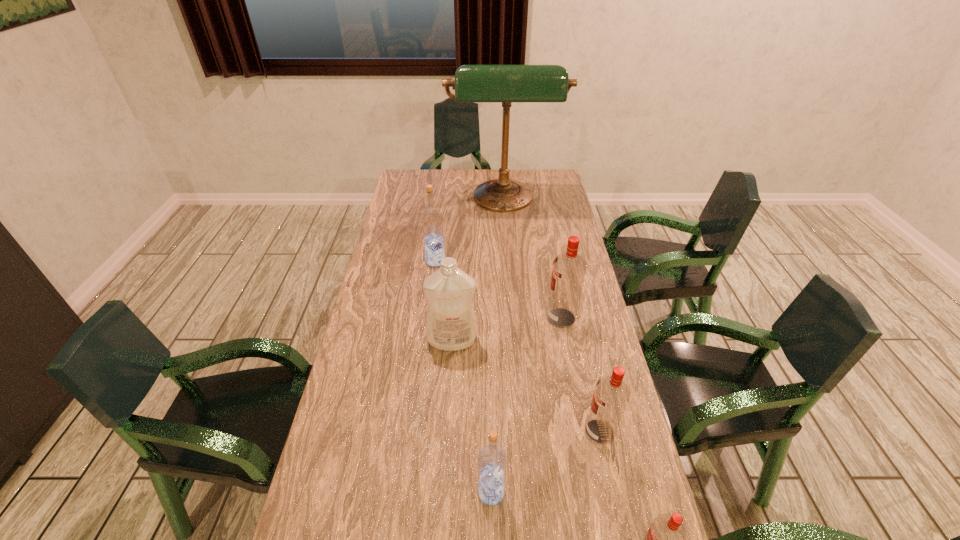
You are a GUI agent. You are given a task and a screenshot of the screen. Output one action in this format:
    pyautogui.click(x=<x>, y=<y>)
    Task: Click on the right blue vodka
    
    Given the screenshot: What is the action you would take?
    pyautogui.click(x=492, y=460)

You are a GUI agent. You are given a task and a screenshot of the screen. Output one action in this format:
    pyautogui.click(x=<x>, y=<y>)
    Task: Click on the vacant space situated 0.340m above the green lampshade of the green table lamp
    
    Given the screenshot: What is the action you would take?
    pyautogui.click(x=510, y=281)

Where is `vacant space located on the front label of the biggest red vodka`? This screenshot has width=960, height=540. vacant space located on the front label of the biggest red vodka is located at coordinates (487, 318).

This screenshot has width=960, height=540. Find the location of `vacant space located on the front label of the biggest red vodka`. vacant space located on the front label of the biggest red vodka is located at coordinates (519, 318).

Where is `blank area located 0.350m on the front label of the biggest red vodka`? The image size is (960, 540). blank area located 0.350m on the front label of the biggest red vodka is located at coordinates (432, 318).

Where is `free spot located on the front of the farthest vodka`? free spot located on the front of the farthest vodka is located at coordinates (430, 302).

Locate an element on the screen. vacant space situated on the front of the white detergent is located at coordinates pos(448,392).

Image resolution: width=960 pixels, height=540 pixels. I want to click on free space located on the front label of the third nearest vodka, so click(497, 432).

This screenshot has height=540, width=960. Find the location of `vacant space situated 0.160m on the front label of the third nearest vodka`. vacant space situated 0.160m on the front label of the third nearest vodka is located at coordinates (518, 432).

This screenshot has width=960, height=540. I want to click on vacant space located on the front label of the third nearest vodka, so click(x=460, y=432).